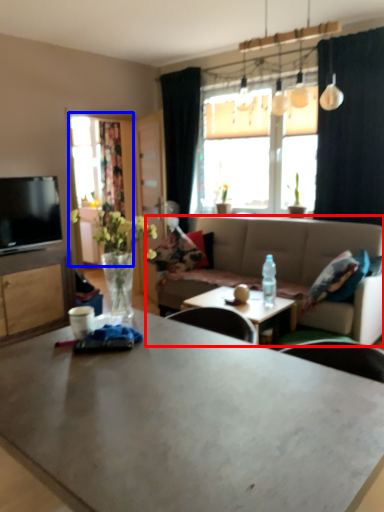
Question: Which of the following is the farthest to the observer, studio couch (highlighted by a red box) or window screen (highlighted by a blue box)?

Choices:
 (A) studio couch
 (B) window screen

Answer: (B)